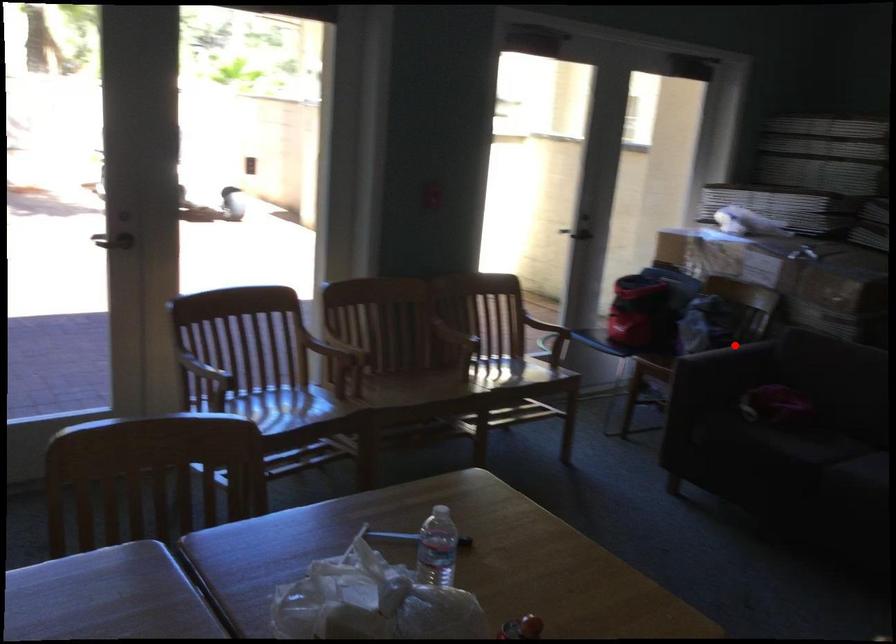
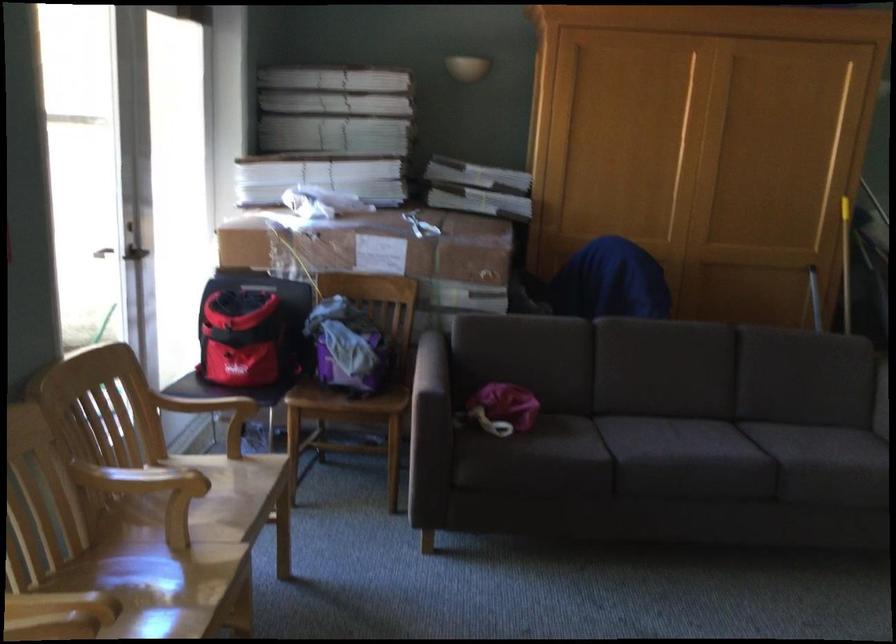
Question: I am providing you with two images of the same scene from different viewpoints. A red point is marked on the first image. Can you still see the location of the red point in image 2?

Choices:
 (A) Yes
 (B) No

Answer: (A)